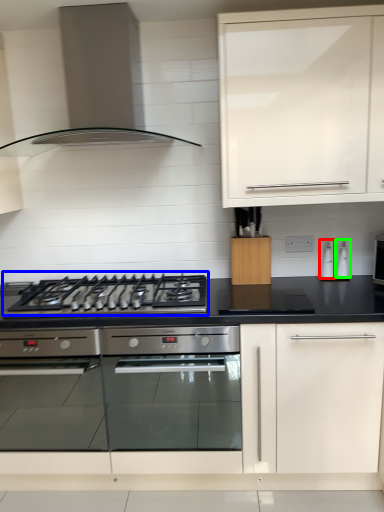
Question: Estimate the real-world distances between objects in this image. Which object is closer to appliance (highlighted by a red box), gas stove (highlighted by a blue box) or kitchen appliance (highlighted by a green box)?

Choices:
 (A) gas stove
 (B) kitchen appliance

Answer: (B)